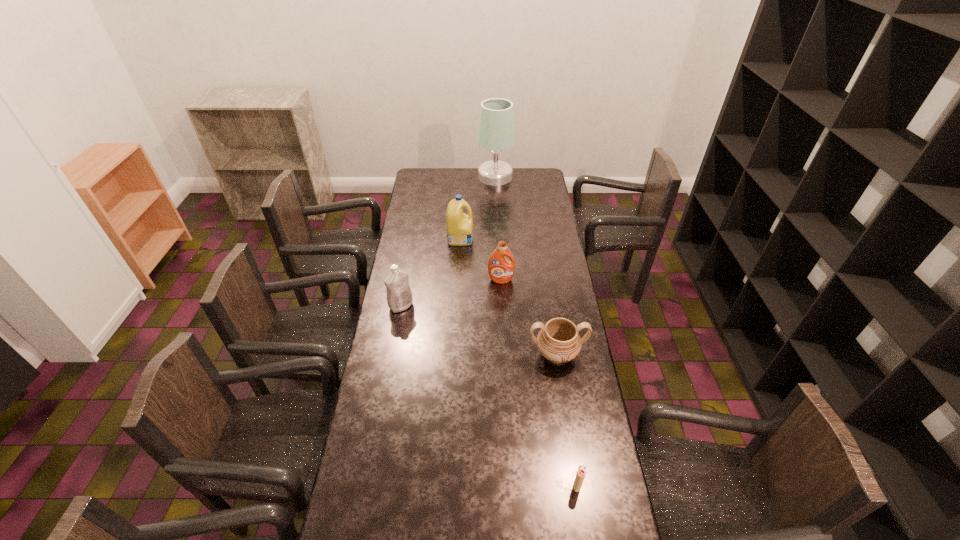
Find the location of `free space that satisfies the following two spatial constraints: 1. on the front side of the nearest object; 2. on the right side of the leftmost detergent`. free space that satisfies the following two spatial constraints: 1. on the front side of the nearest object; 2. on the right side of the leftmost detergent is located at coordinates (369, 485).

The image size is (960, 540). Identify the location of vacant position in the image that satisfies the following two spatial constraints: 1. on the back side of the nearest object; 2. on the base of the tallest object. (529, 177).

I want to click on blank area in the image that satisfies the following two spatial constraints: 1. on the front-facing side of the nearest object; 2. on the right side of the fifth farthest object, so click(x=577, y=485).